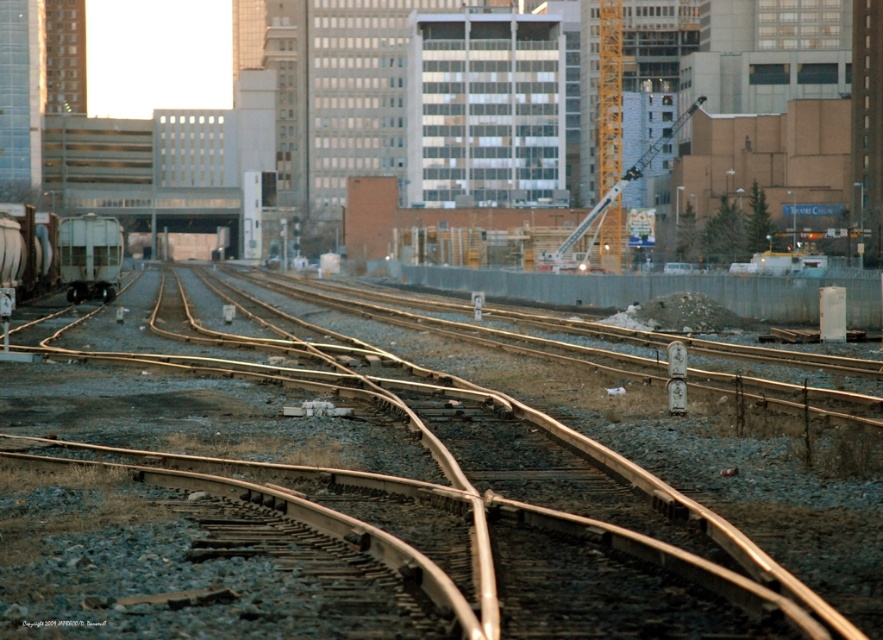
Question: Which of the following is the farthest from the observer?

Choices:
 (A) (97, 604)
 (B) (642, 157)
 (C) (110, 227)
 (D) (74, 236)

Answer: (B)

Question: Among these objects, which one is nearest to the camera?

Choices:
 (A) yellow metallic crane at upper center
 (B) gray matte train car at left
 (C) metallic brown tracks at center
 (D) matte silver train car at left

Answer: (C)

Question: Is gray matte train car at left closer to camera compared to yellow metallic crane at upper center?

Choices:
 (A) yes
 (B) no

Answer: (A)

Question: Which object appears farthest from the camera in this image?

Choices:
 (A) matte silver train car at left
 (B) gray matte train car at left
 (C) yellow metallic crane at upper center
 (D) metallic brown tracks at center

Answer: (C)

Question: Does metallic brown tracks at center have a smaller size compared to yellow metallic crane at upper center?

Choices:
 (A) no
 (B) yes

Answer: (B)

Question: Does gray matte train car at left have a lesser width compared to yellow metallic crane at upper center?

Choices:
 (A) no
 (B) yes

Answer: (B)